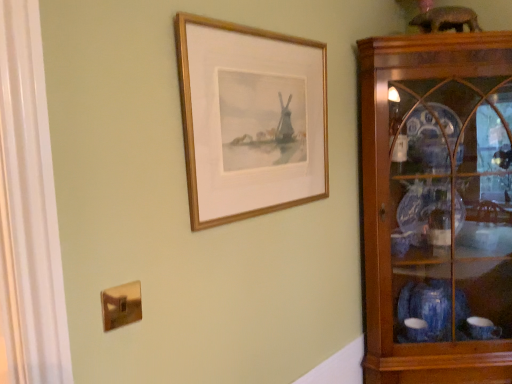
Question: Could you tell me if gold wood picture frame at upper center is turned towards wooden cabinet at right?

Choices:
 (A) no
 (B) yes

Answer: (A)

Question: Are gold wood picture frame at upper center and wooden cabinet at right beside each other?

Choices:
 (A) no
 (B) yes

Answer: (A)

Question: Could wooden cabinet at right be considered to be inside gold wood picture frame at upper center?

Choices:
 (A) no
 (B) yes

Answer: (A)

Question: From a real-world perspective, is gold wood picture frame at upper center physically below wooden cabinet at right?

Choices:
 (A) yes
 (B) no

Answer: (B)

Question: From the image's perspective, would you say gold wood picture frame at upper center is positioned over wooden cabinet at right?

Choices:
 (A) yes
 (B) no

Answer: (A)

Question: Considering the relative positions of gold wood picture frame at upper center and wooden cabinet at right in the image provided, is gold wood picture frame at upper center to the left of wooden cabinet at right from the viewer's perspective?

Choices:
 (A) yes
 (B) no

Answer: (A)

Question: Is wooden cabinet at right at the right side of gold wood picture frame at upper center?

Choices:
 (A) yes
 (B) no

Answer: (A)

Question: Is wooden cabinet at right outside of gold wood picture frame at upper center?

Choices:
 (A) yes
 (B) no

Answer: (A)

Question: From the image's perspective, is wooden cabinet at right on top of gold wood picture frame at upper center?

Choices:
 (A) yes
 (B) no

Answer: (B)

Question: Are wooden cabinet at right and gold wood picture frame at upper center located far from each other?

Choices:
 (A) no
 (B) yes

Answer: (A)

Question: Is wooden cabinet at right next to gold wood picture frame at upper center and touching it?

Choices:
 (A) no
 (B) yes

Answer: (A)

Question: Does wooden cabinet at right turn towards gold wood picture frame at upper center?

Choices:
 (A) yes
 (B) no

Answer: (B)

Question: Is gold wood picture frame at upper center to the left or to the right of wooden cabinet at right in the image?

Choices:
 (A) right
 (B) left

Answer: (B)